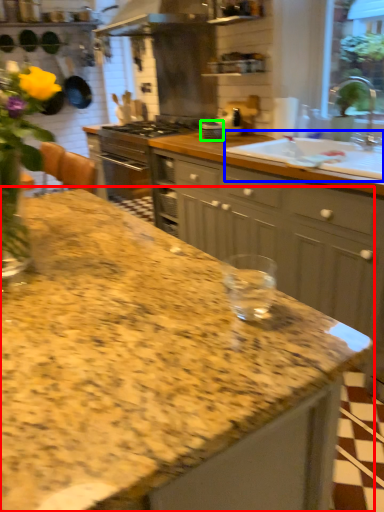
Question: Based on their relative distances, which object is farther from countertop (highlighted by a red box)? Choose from sink (highlighted by a blue box) and appliance (highlighted by a green box).

Choices:
 (A) sink
 (B) appliance

Answer: (B)